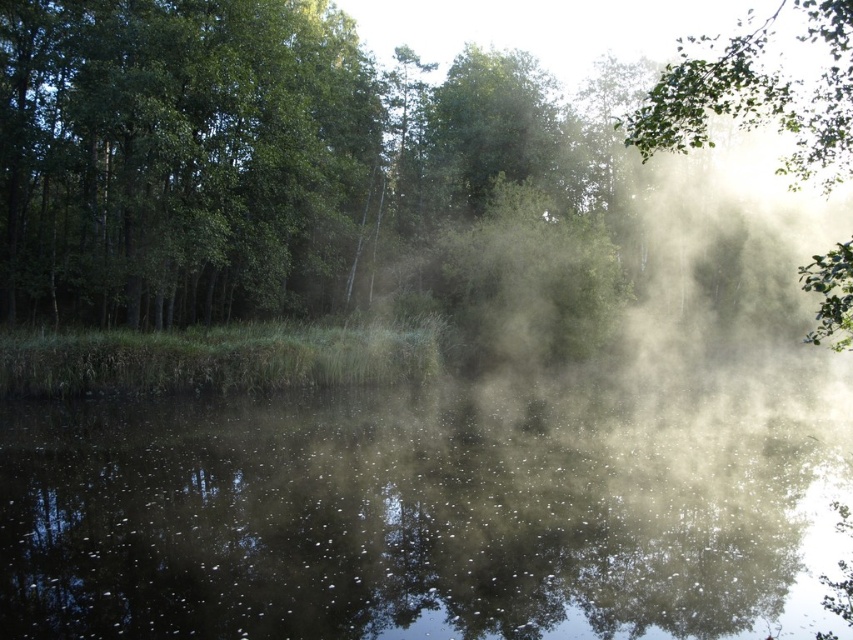
Consider the image. Can you confirm if green leafy tree at left is taller than green leafy tree at upper right?

No.

Describe the element at coordinates (178, 157) in the screenshot. I see `green leafy tree at left` at that location.

Where is `green leafy tree at left`? This screenshot has width=853, height=640. green leafy tree at left is located at coordinates (178, 157).

Does point (676, 548) come closer to viewer compared to point (675, 88)?

Yes.

Does translucent misty water at center have a lesser height compared to green leafy tree at upper right?

Yes, translucent misty water at center is shorter than green leafy tree at upper right.

Locate an element on the screen. translucent misty water at center is located at coordinates (407, 520).

The height and width of the screenshot is (640, 853). Find the location of `translucent misty water at center`. translucent misty water at center is located at coordinates (407, 520).

Can you confirm if translucent misty water at center is positioned above green leafy tree at upper center?

Actually, translucent misty water at center is below green leafy tree at upper center.

Is point (222, 621) positioned behind point (828, 288)?

Yes.

Which is in front, point (691, 420) or point (395, 163)?

Point (691, 420)

Where is `translucent misty water at center`? The height and width of the screenshot is (640, 853). translucent misty water at center is located at coordinates (407, 520).